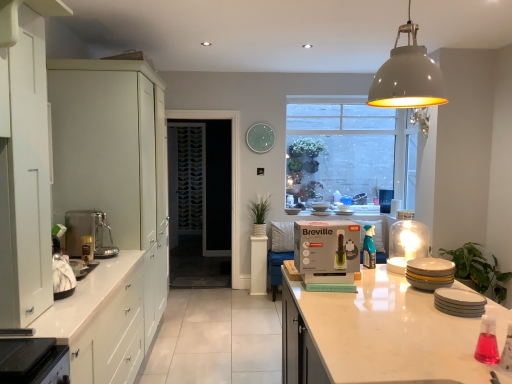
Question: Is patterned glass screen door at center at the back of matte gray dome at upper center?

Choices:
 (A) yes
 (B) no

Answer: (A)

Question: Is matte gray dome at upper center at the left side of patterned glass screen door at center?

Choices:
 (A) no
 (B) yes

Answer: (A)

Question: From the image's perspective, is matte gray dome at upper center above patterned glass screen door at center?

Choices:
 (A) no
 (B) yes

Answer: (B)

Question: Considering the relative sizes of matte gray dome at upper center and patterned glass screen door at center in the image provided, is matte gray dome at upper center taller than patterned glass screen door at center?

Choices:
 (A) yes
 (B) no

Answer: (B)

Question: Is matte gray dome at upper center positioned behind patterned glass screen door at center?

Choices:
 (A) no
 (B) yes

Answer: (A)

Question: Is green matte plant at center, which is the first plant from back to front, inside the boundaries of patterned glass screen door at center, or outside?

Choices:
 (A) inside
 (B) outside

Answer: (B)

Question: Is green matte plant at center, which is counted as the first plant, starting from the left, bigger or smaller than patterned glass screen door at center?

Choices:
 (A) big
 (B) small

Answer: (B)

Question: Considering the positions of green matte plant at center, which is counted as the first plant, starting from the left, and patterned glass screen door at center in the image, is green matte plant at center, which is counted as the first plant, starting from the left, taller or shorter than patterned glass screen door at center?

Choices:
 (A) tall
 (B) short

Answer: (B)

Question: From a real-world perspective, relative to patterned glass screen door at center, is green matte plant at center, which is counted as the first plant, starting from the left, vertically above or below?

Choices:
 (A) above
 (B) below

Answer: (B)

Question: From the image's perspective, relative to matte white cabinets at left, which appears as the second cabinetry when viewed from the front, is white glossy countertop at lower left, arranged as the 2th countertop when viewed from the right, above or below?

Choices:
 (A) above
 (B) below

Answer: (B)

Question: From a real-world perspective, is white glossy countertop at lower left, marked as the first countertop in a front-to-back arrangement, positioned above or below matte white cabinets at left, the first cabinetry positioned from the back?

Choices:
 (A) above
 (B) below

Answer: (B)

Question: Would you say white glossy countertop at lower left, which appears as the 1th countertop when viewed from the left, is to the left or to the right of matte white cabinets at left, the first cabinetry positioned from the back, in the picture?

Choices:
 (A) left
 (B) right

Answer: (B)

Question: Considering the positions of white glossy countertop at lower left, marked as the first countertop in a front-to-back arrangement, and matte white cabinets at left, the first cabinetry positioned from the back, in the image, is white glossy countertop at lower left, marked as the first countertop in a front-to-back arrangement, wider or thinner than matte white cabinets at left, the first cabinetry positioned from the back,?

Choices:
 (A) thin
 (B) wide

Answer: (A)

Question: In terms of width, does translucent glass dome at upper right, marked as the 3th appliance in a front-to-back arrangement, look wider or thinner when compared to matte gray dome at upper center?

Choices:
 (A) thin
 (B) wide

Answer: (A)

Question: Is translucent glass dome at upper right, marked as the 3th appliance in a front-to-back arrangement, in front of or behind matte gray dome at upper center in the image?

Choices:
 (A) front
 (B) behind

Answer: (B)